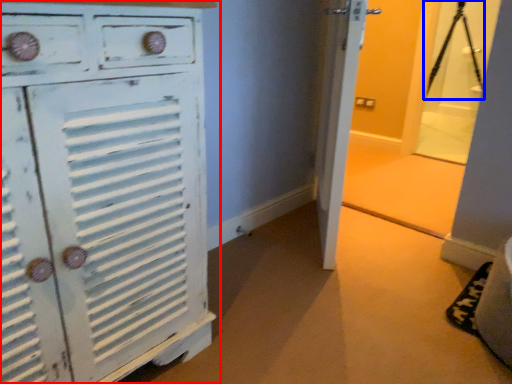
Question: Among these objects, which one is farthest to the camera, chest of drawers (highlighted by a red box) or tripod (highlighted by a blue box)?

Choices:
 (A) chest of drawers
 (B) tripod

Answer: (B)